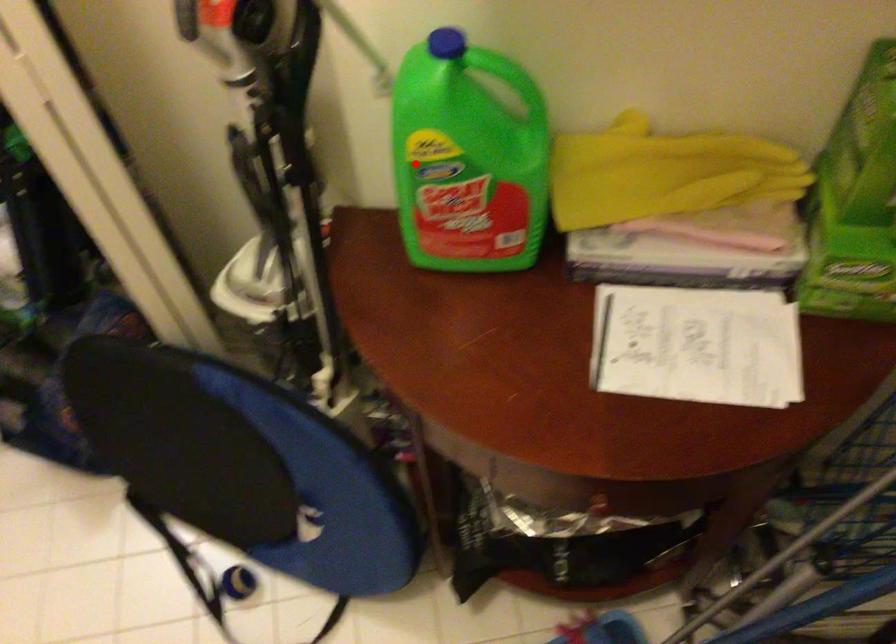
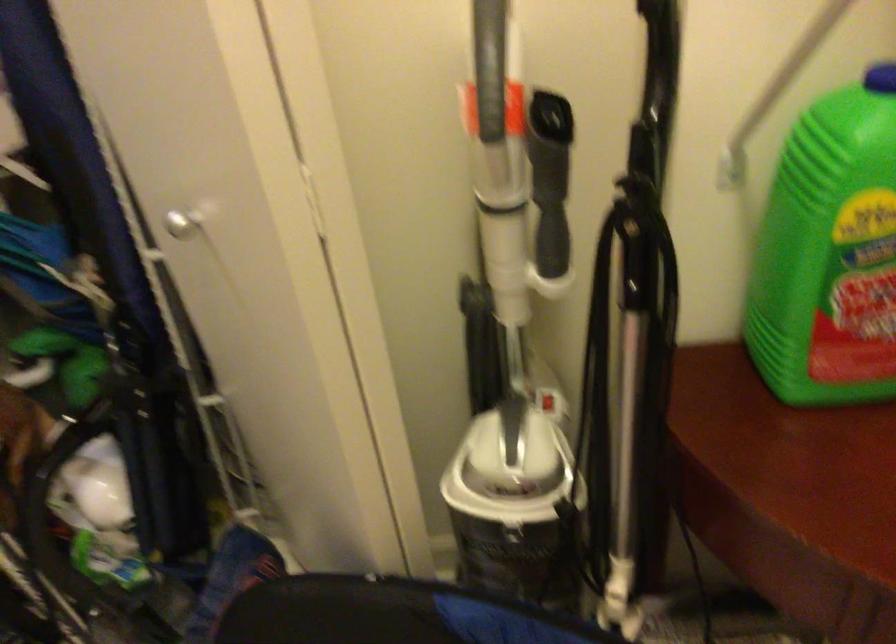
Find the pixel in the second image that matches the highlighted location in the first image.

(830, 252)